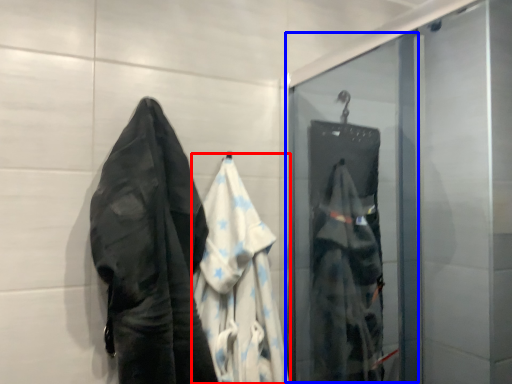
Question: Which of the following is the closest to the observer, garment (highlighted by a red box) or screen door (highlighted by a blue box)?

Choices:
 (A) garment
 (B) screen door

Answer: (A)